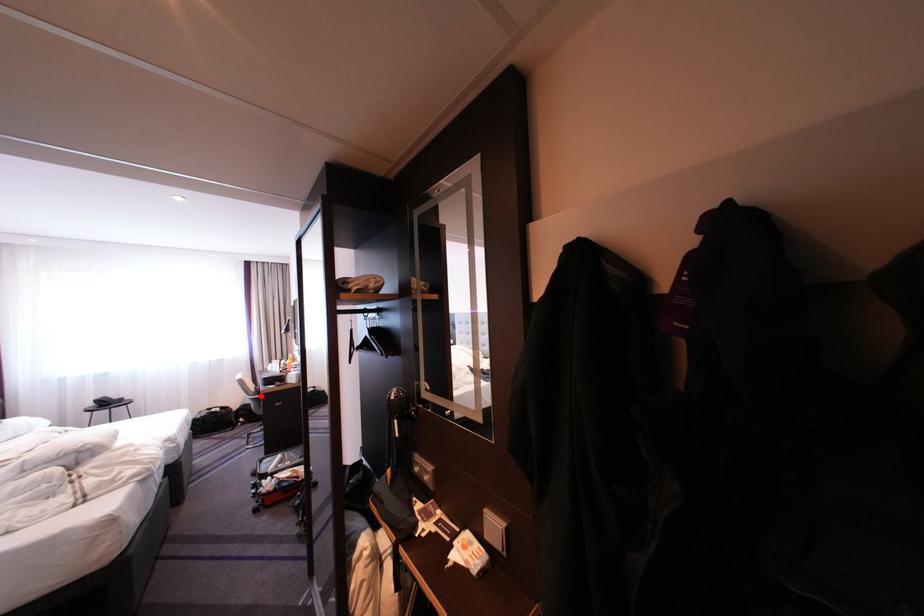
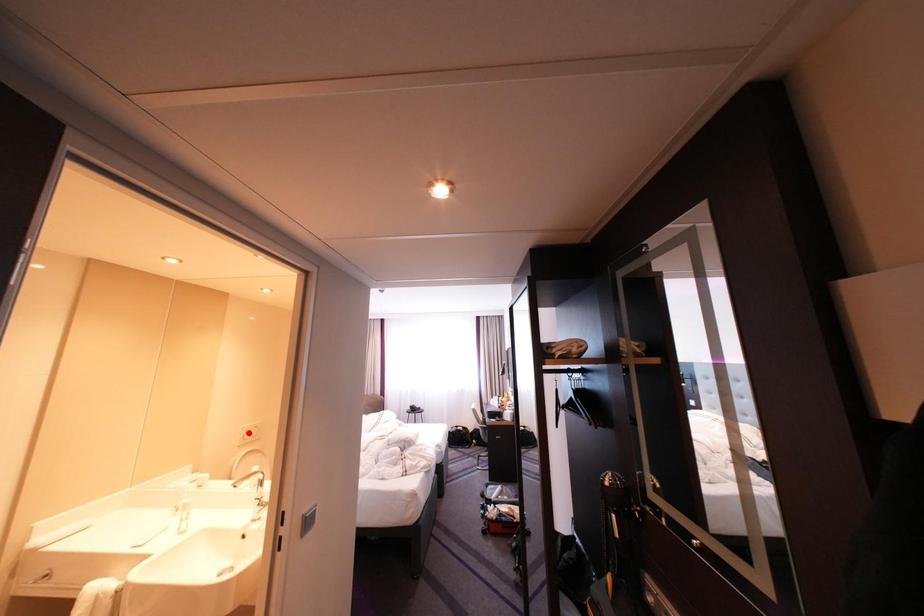
I am providing you with two images of the same scene from different viewpoints. A red point is marked on the first image and another point is marked on the second image. Is the red point in image1 aligned with the point shown in image2?

No